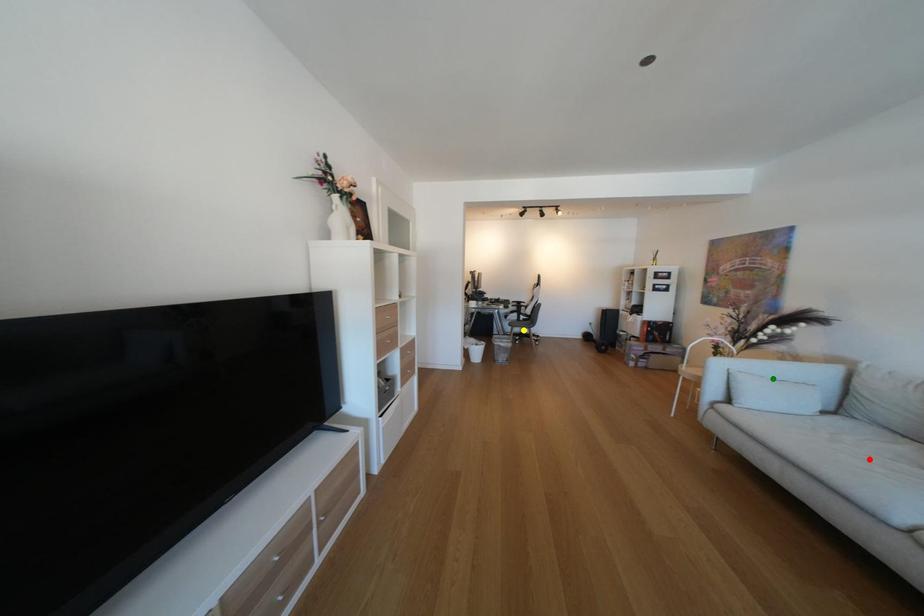
Order these from nearest to farthest:
- green point
- yellow point
- red point

yellow point, green point, red point